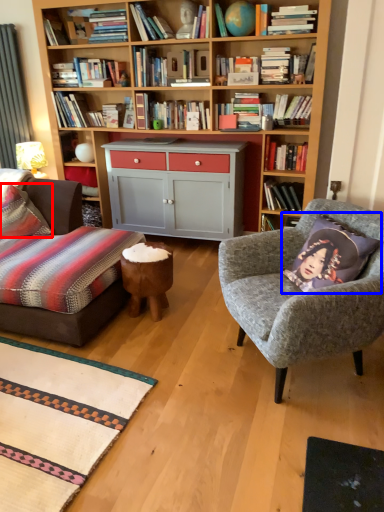
Question: Which point is closer to the camera, pillow (highlighted by a red box) or throw pillow (highlighted by a blue box)?

Choices:
 (A) pillow
 (B) throw pillow

Answer: (B)